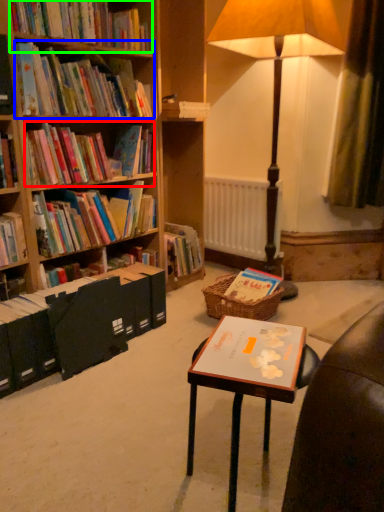
Question: Which object is positioned closest to book (highlighted by a red box)? Select from book (highlighted by a blue box) and book (highlighted by a green box).

Choices:
 (A) book
 (B) book

Answer: (A)